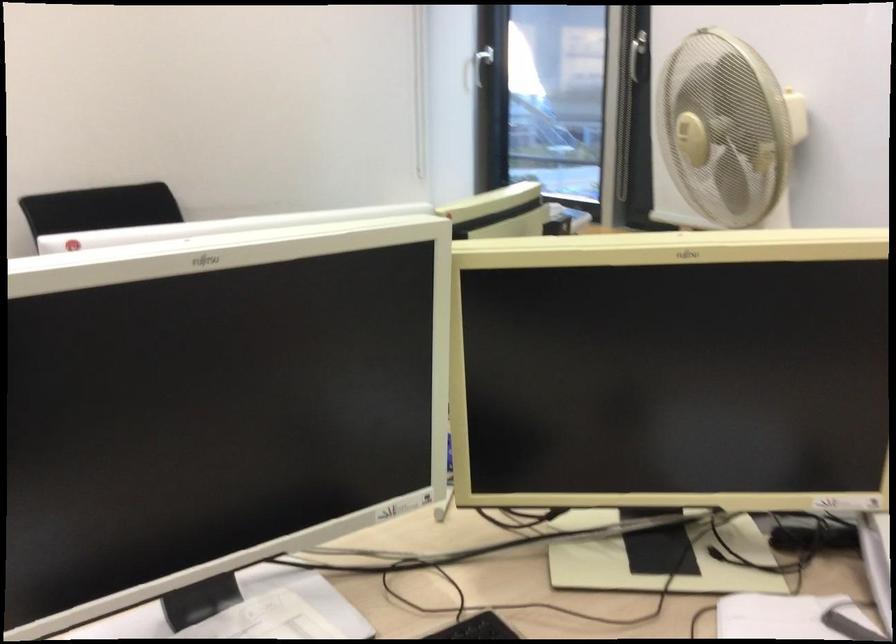
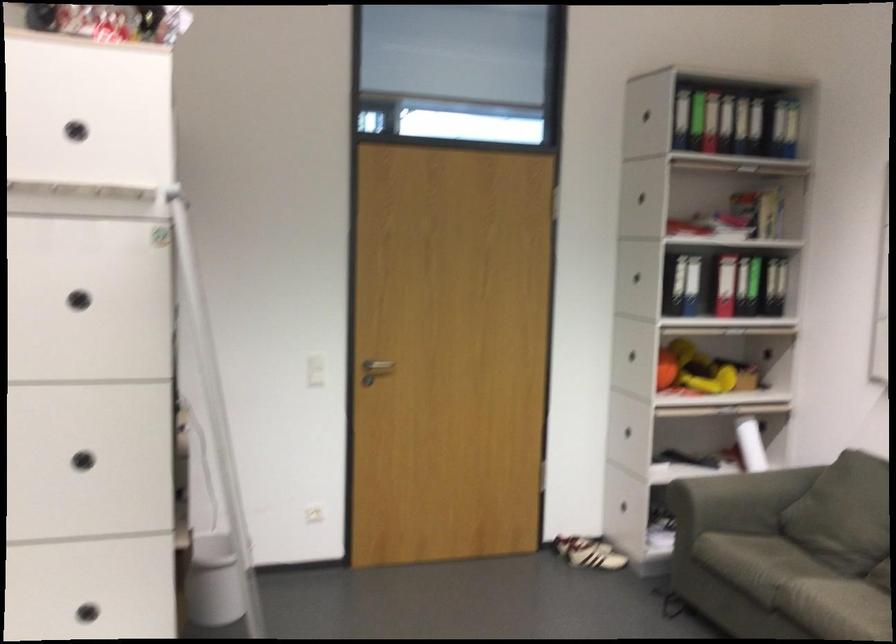
Question: Based on the continuous images, in which direction is the camera rotating? Reply with the corresponding letter.

Choices:
 (A) Left
 (B) Right
 (C) Up
 (D) Down

Answer: (A)